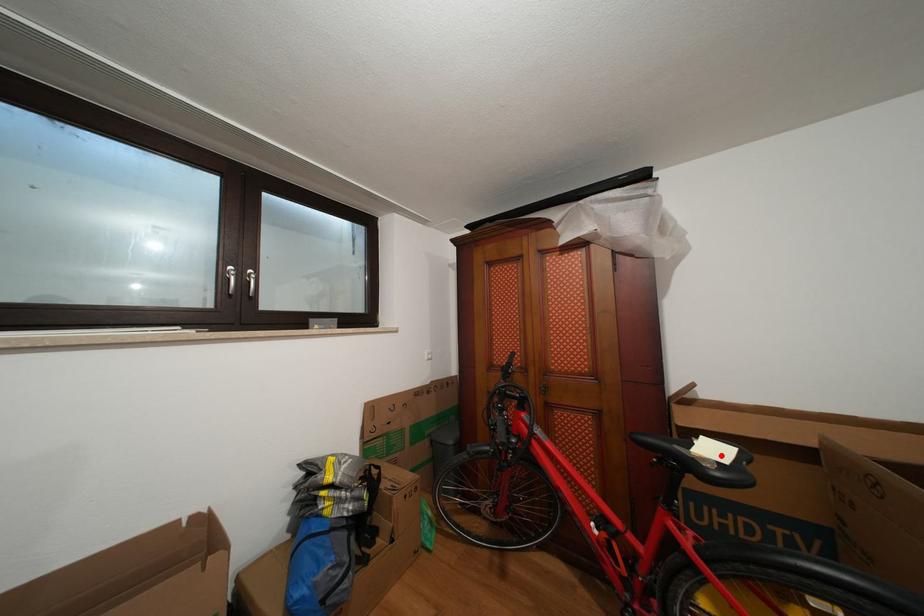
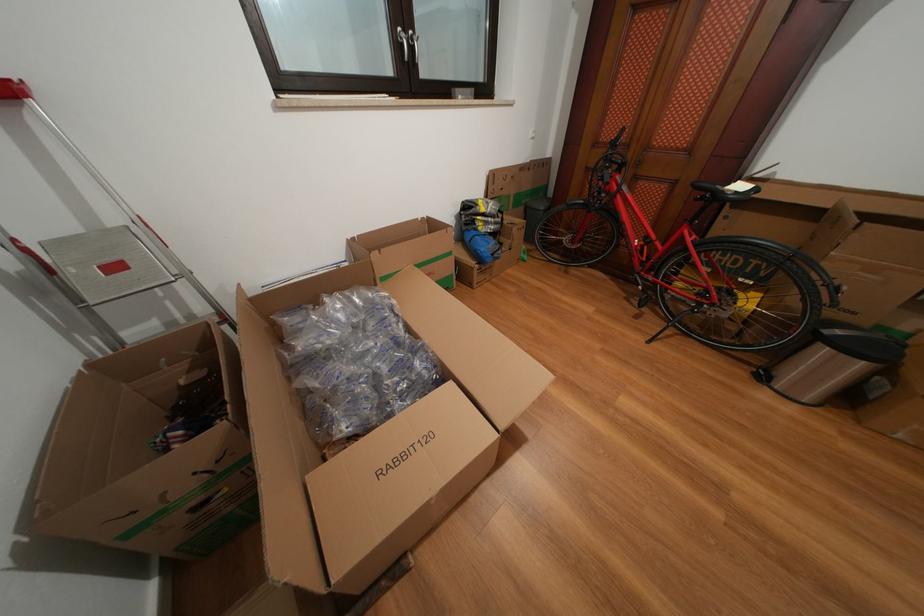
In the second image, find the point that corresponds to the highlighted location in the first image.

(747, 192)